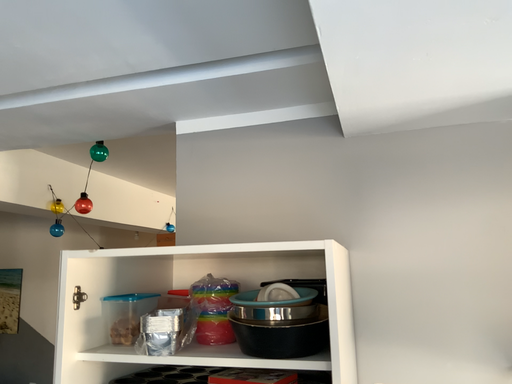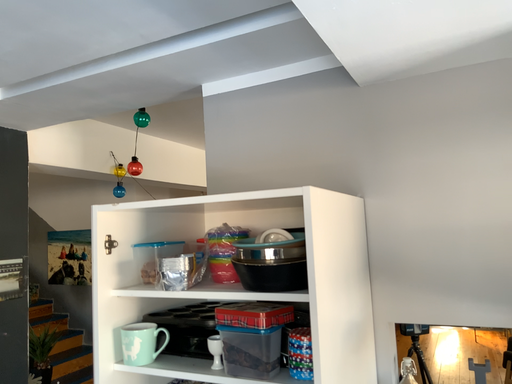
Question: Which way did the camera rotate in the video?

Choices:
 (A) rotated right
 (B) rotated left

Answer: (B)